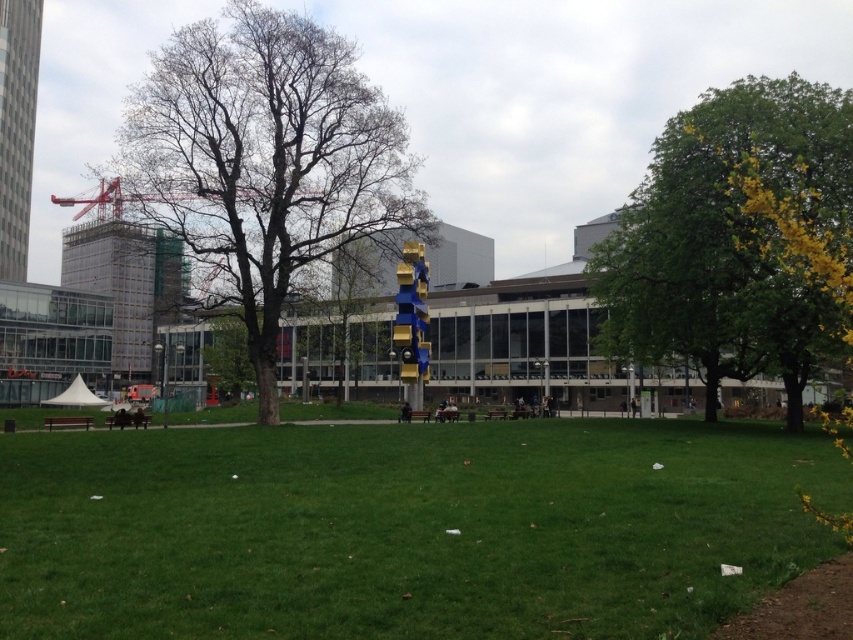
Question: Which of these objects is positioned closest to the bare wood tree at center?

Choices:
 (A) green leafy tree at right
 (B) green grass at center
 (C) red metal crane at upper left

Answer: (B)

Question: Which point is farther to the camera?

Choices:
 (A) (213, 97)
 (B) (413, 438)
 (C) (96, 202)

Answer: (C)

Question: Which object is farther from the camera taking this photo?

Choices:
 (A) green leafy tree at right
 (B) red metal crane at upper left

Answer: (B)

Question: Is bare wood tree at center below green leafy tree at right?

Choices:
 (A) yes
 (B) no

Answer: (A)

Question: Does bare wood tree at center have a larger size compared to green leafy tree at right?

Choices:
 (A) yes
 (B) no

Answer: (B)

Question: Can you confirm if bare wood tree at center is bigger than green leafy tree at right?

Choices:
 (A) yes
 (B) no

Answer: (B)